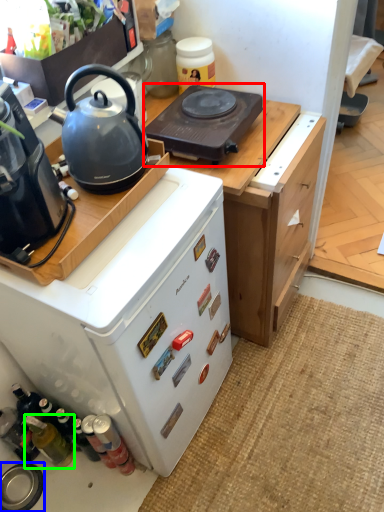
Question: Which object is positioned closest to gas stove (highlighted by a red box)? Select from kitchen appliance (highlighted by a blue box) and bottle (highlighted by a green box).

Choices:
 (A) kitchen appliance
 (B) bottle

Answer: (B)